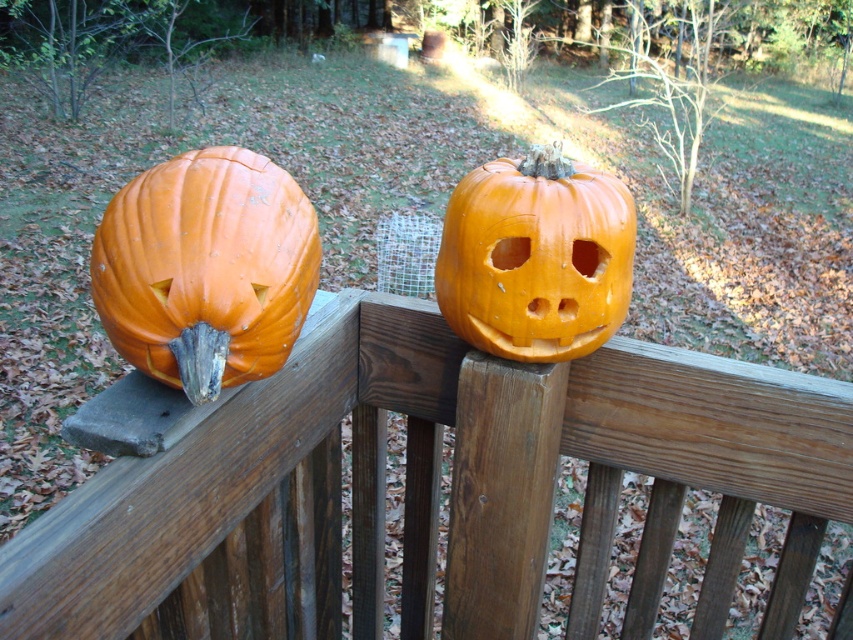
Question: Which point appears closest to the camera in this image?

Choices:
 (A) (608, 198)
 (B) (134, 362)

Answer: (B)

Question: Is orange matte pumpkin at left closer to camera compared to orange matte pumpkin at center?

Choices:
 (A) no
 (B) yes

Answer: (B)

Question: Is wooden fence at upper center to the right of orange matte pumpkin at center from the viewer's perspective?

Choices:
 (A) no
 (B) yes

Answer: (A)

Question: Which point is closer to the camera taking this photo?

Choices:
 (A) (189, 328)
 (B) (573, 220)

Answer: (A)

Question: Among these points, which one is farthest from the camera?

Choices:
 (A) (131, 291)
 (B) (550, 330)

Answer: (B)

Question: Can you confirm if orange matte pumpkin at left is bigger than orange matte pumpkin at center?

Choices:
 (A) yes
 (B) no

Answer: (A)